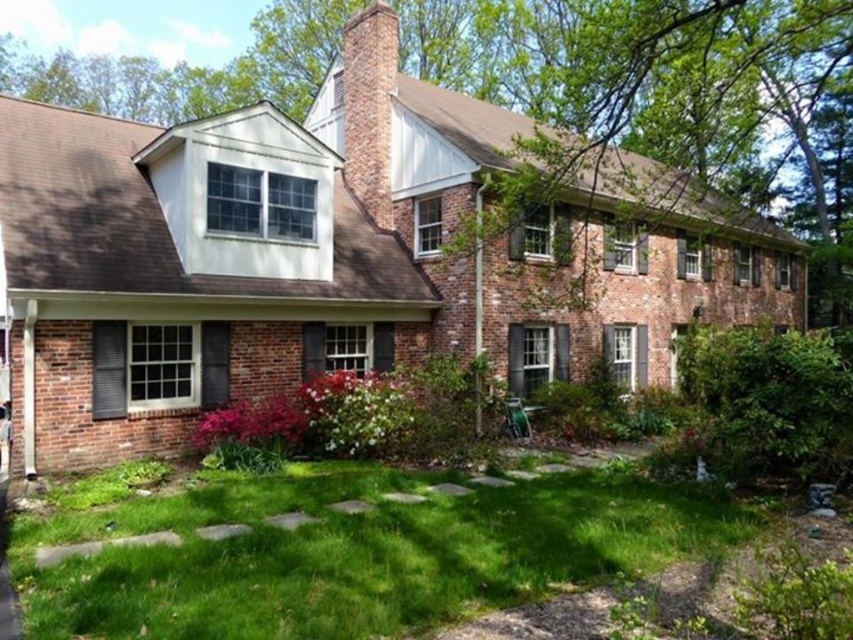
You are standing in front of the house and want to walk to the brick chimney at center. Which direction should you move from the green grass at lower center to reach it?

The brick chimney at center is above the green grass at lower center, so you should move upward from the green grass at lower center to reach the brick chimney at center.

You are a gardener planning to install a sprinkler system. You need to ensure the sprinkler can reach both the green grass at lower center and the brick chimney at center. What is the minimum distance the sprinkler must cover?

The green grass at lower center and the brick chimney at center are 8.87 meters apart from each other. Therefore, the sprinkler must be able to cover at least 8.87 meters to reach both areas.

You are standing in front of the two story residential house and want to place a 2 meter tall decoration exactly at point (x=404, y=515). Will the decoration be visible from the front entrance which is 5 meters away from the camera? Please explain your answer.

The distance of point (x=404, y=515) from camera is 7.36 meters, which is further away than the 5 meters distance of the front entrance. Therefore, the 2 meter tall decoration placed at point (x=404, y=515) would not be visible from the front entrance since it is located behind the entrance area.